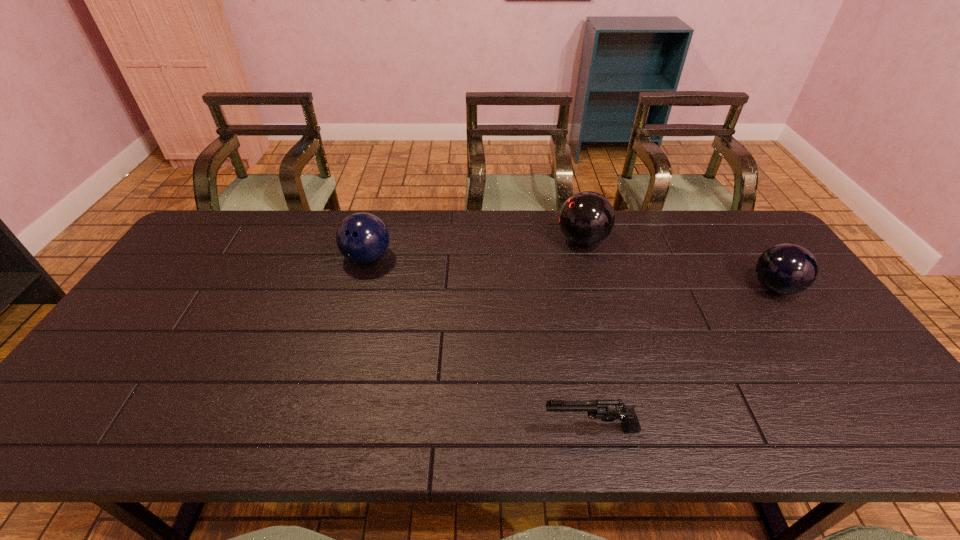
You are a GUI agent. You are given a task and a screenshot of the screen. Output one action in this format:
    pyautogui.click(x=<x>, y=<y>)
    Task: Click on the vacant space at the far left corner of the desktop
    The height and width of the screenshot is (540, 960).
    Given the screenshot: What is the action you would take?
    pyautogui.click(x=237, y=222)

Where is `free point at the far right corner`? The width and height of the screenshot is (960, 540). free point at the far right corner is located at coordinates (729, 238).

The image size is (960, 540). I want to click on blank region between the second bowling ball from right to left and the rightmost bowling ball, so (x=679, y=264).

The width and height of the screenshot is (960, 540). Identify the location of free space between the rightmost object and the gun. (683, 358).

You are a GUI agent. You are given a task and a screenshot of the screen. Output one action in this format:
    pyautogui.click(x=<x>, y=<y>)
    Task: Click on the vacant space that's between the shortest object and the leftmost bowling ball
    
    Given the screenshot: What is the action you would take?
    pyautogui.click(x=479, y=343)

The width and height of the screenshot is (960, 540). What are the coordinates of `free area in between the rightmost object and the second bowling ball from left to right` in the screenshot? It's located at (679, 264).

Locate an element on the screen. This screenshot has height=540, width=960. vacant space in between the leftmost object and the gun is located at coordinates (479, 343).

Identify the location of vacant space that is in between the rightmost object and the leftmost object. The height and width of the screenshot is (540, 960). (571, 273).

I want to click on vacant space in between the rightmost bowling ball and the second bowling ball from right to left, so click(679, 264).

Where is `unoccupied area between the gun and the second bowling ball from left to right`? unoccupied area between the gun and the second bowling ball from left to right is located at coordinates (587, 334).